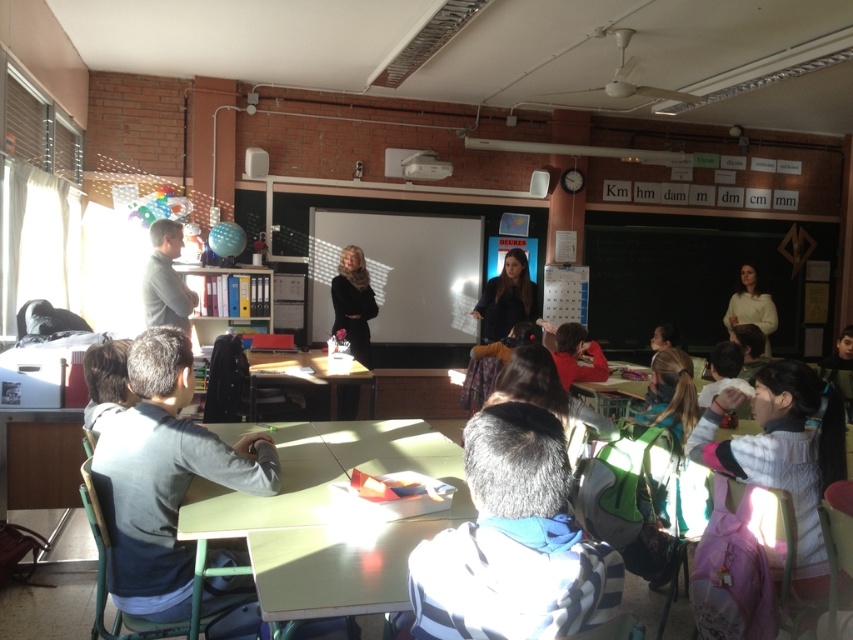
You are a student who wants to pass a pencil from the striped fabric at center to the white fleece jacket at lower right. Can you do it without leaving your seat?

The striped fabric at center is 1.39 meters away from the white fleece jacket at lower right. Since the average human arm span is about 1.5 meters, you can reach it by stretching your arm.

You are a student sitting at your desk in the classroom. You notice two points marked in the room. Which of the two points, point [169,275] or point [503,307], is closer to you?

Point [169,275] is closer to the viewer than point [503,307].

You are a student who needs to place a heavy textbook on the table. Which table, the green matte table at center or the green plastic table at center, can better support the weight?

The green plastic table at center is thicker than the green matte table at center, so it can better support the weight of the heavy textbook.